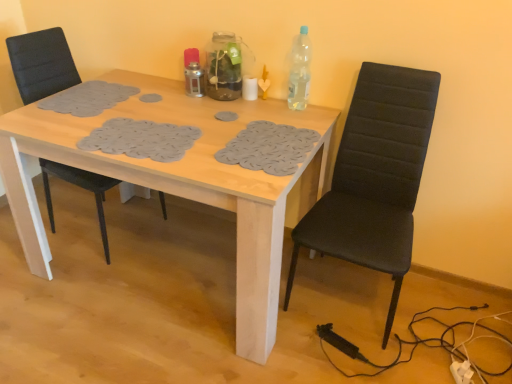
Where is `free space in front of black fabric chair at right, the first chair from the right`? Image resolution: width=512 pixels, height=384 pixels. free space in front of black fabric chair at right, the first chair from the right is located at coordinates (357, 362).